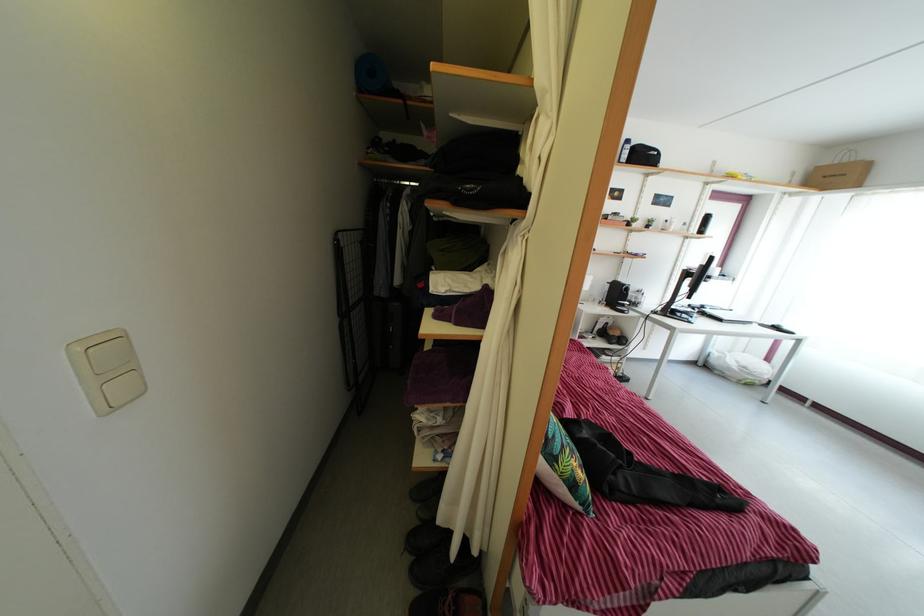
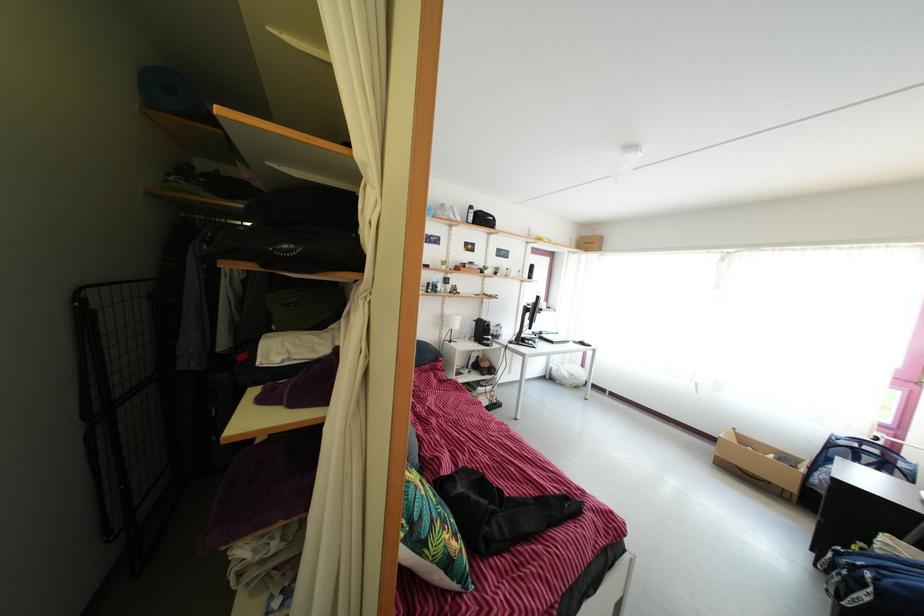
Question: The images are taken continuously from a first-person perspective. In which direction are you moving?

Choices:
 (A) Left
 (B) Right
 (C) Forward
 (D) Backward

Answer: (B)